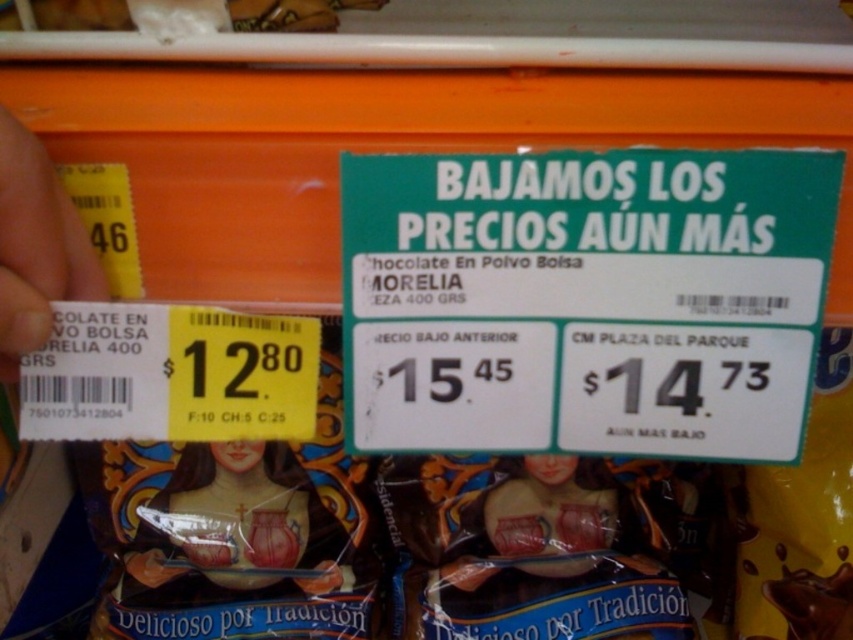
Who is taller, matte brown statue at center or yellow paper at left?

matte brown statue at center is taller.

Does matte brown statue at center have a greater height compared to yellow paper at left?

Yes.

You are a GUI agent. You are given a task and a screenshot of the screen. Output one action in this format:
    pyautogui.click(x=<x>, y=<y>)
    Task: Click on the matte brown statue at center
    
    Given the screenshot: What is the action you would take?
    pyautogui.click(x=248, y=518)

The height and width of the screenshot is (640, 853). I want to click on matte brown statue at center, so click(248, 518).

Is yellow paper at left shorter than matte plastic doll at center?

Correct, yellow paper at left is not as tall as matte plastic doll at center.

Is yellow paper at left positioned behind matte plastic doll at center?

No, yellow paper at left is closer to the viewer.

Which is behind, point (15, 205) or point (532, 456)?

The point (532, 456) is more distant.

This screenshot has height=640, width=853. What are the coordinates of `yellow paper at left` in the screenshot? It's located at (36, 246).

Does point (256, 486) come farther from viewer compared to point (581, 502)?

No.

Which is below, matte brown statue at center or matte plastic doll at center?

Positioned lower is matte plastic doll at center.

What do you see at coordinates (248, 518) in the screenshot? I see `matte brown statue at center` at bounding box center [248, 518].

You are a GUI agent. You are given a task and a screenshot of the screen. Output one action in this format:
    pyautogui.click(x=<x>, y=<y>)
    Task: Click on the matte brown statue at center
    The width and height of the screenshot is (853, 640).
    Given the screenshot: What is the action you would take?
    pyautogui.click(x=248, y=518)